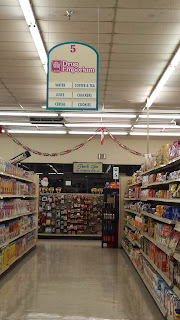
The height and width of the screenshot is (320, 180). Find the location of `ceiling`. ceiling is located at coordinates (142, 24).